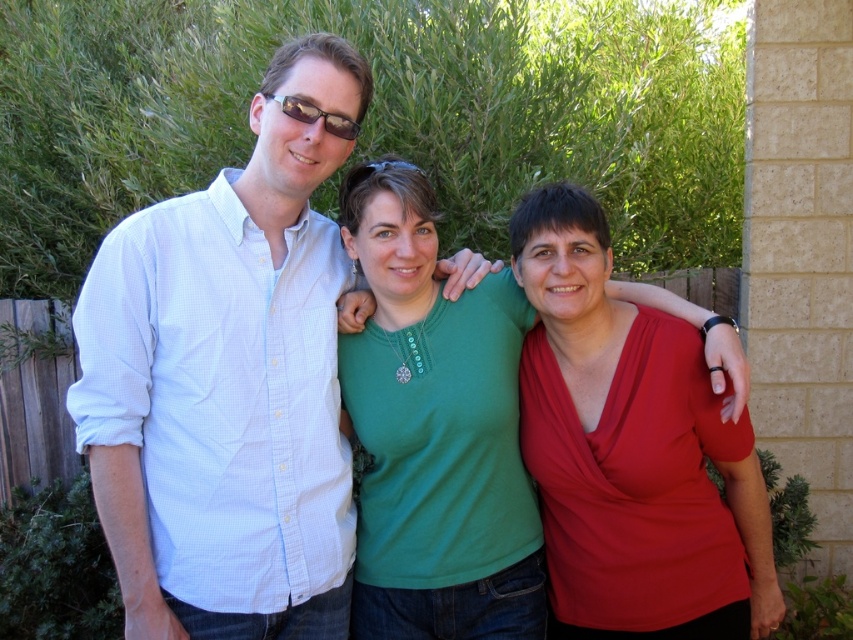
Between white checkered shirt at left and green matte shirt at center, which one appears on the right side from the viewer's perspective?

green matte shirt at center

Measure the distance between white checkered shirt at left and green matte shirt at center.

white checkered shirt at left is 13.70 inches from green matte shirt at center.

Between point (247, 227) and point (437, 420), which one is positioned in front?

Point (247, 227) is more forward.

Image resolution: width=853 pixels, height=640 pixels. Identify the location of white checkered shirt at left. (229, 380).